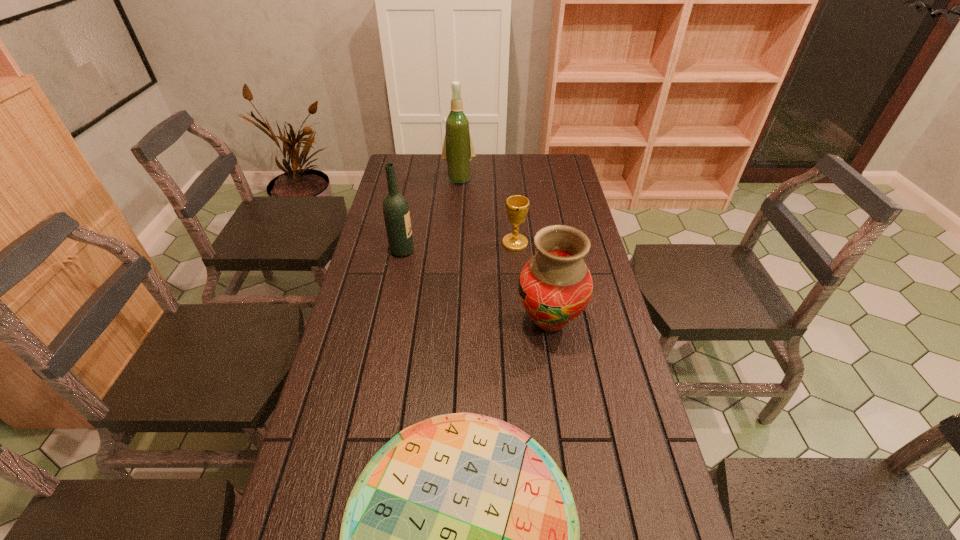
Where is `object situated at the far edge`? This screenshot has height=540, width=960. object situated at the far edge is located at coordinates (458, 151).

At what (x,y) coordinates should I click in order to perform the action: click on object at the left edge. Please return your answer as a coordinate pair (x, y). Looking at the image, I should click on (396, 213).

Where is `object present at the right edge`? This screenshot has width=960, height=540. object present at the right edge is located at coordinates (555, 286).

The image size is (960, 540). In the image, there is a desktop. In order to click on blank space at the far edge in this screenshot , I will do `click(487, 161)`.

Locate an element on the screen. This screenshot has width=960, height=540. free space at the left edge is located at coordinates (385, 233).

Locate an element on the screen. This screenshot has height=540, width=960. free region at the right edge of the desktop is located at coordinates (553, 216).

Locate an element on the screen. vacant region between the second shortest object and the shorter wine bottle is located at coordinates (459, 247).

Locate an element on the screen. unoccupied position between the right wine bottle and the shorter wine bottle is located at coordinates (431, 215).

Locate an element on the screen. The image size is (960, 540). vacant space that is in between the second shortest object and the left wine bottle is located at coordinates (459, 247).

I want to click on object that is the closest to the shorter wine bottle, so click(517, 206).